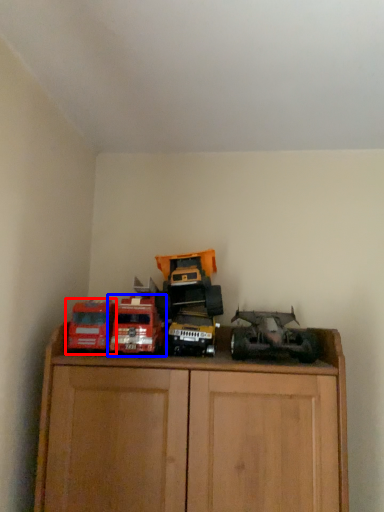
Question: Which object appears farthest to the camera in this image, toy (highlighted by a red box) or toy (highlighted by a blue box)?

Choices:
 (A) toy
 (B) toy

Answer: (B)